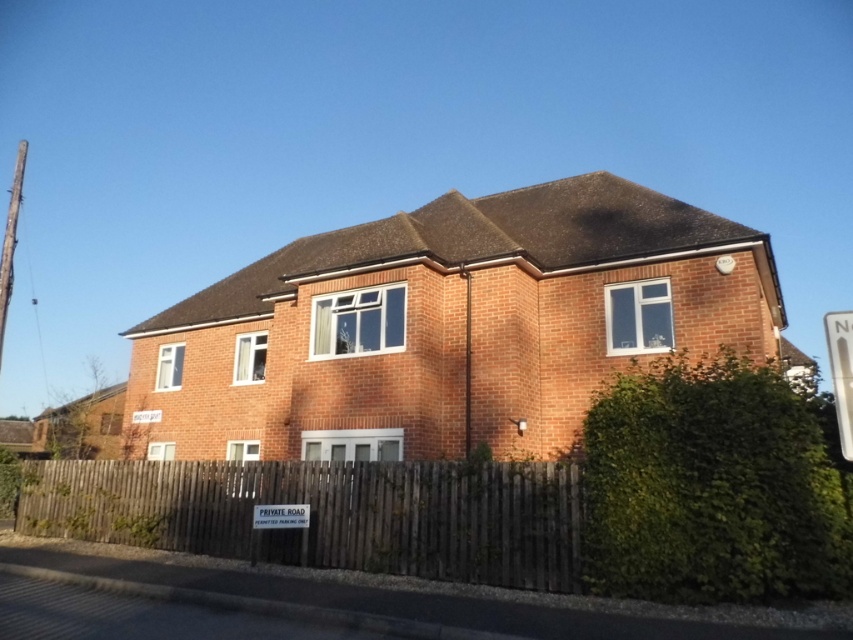
You are standing in front of the house and notice two points marked on the image. Which point, point (741,486) or point (421,548), is closer to you?

Point (741,486) is closer to the viewer than point (421,548).

You are a delivery person trying to see the house number. You notice the brown wooden fence at lower center and the white plastic sign at upper right. Which object is taller and could potentially block your view of the house number?

The brown wooden fence at lower center is taller than the white plastic sign at upper right, so it could potentially block your view of the house number.